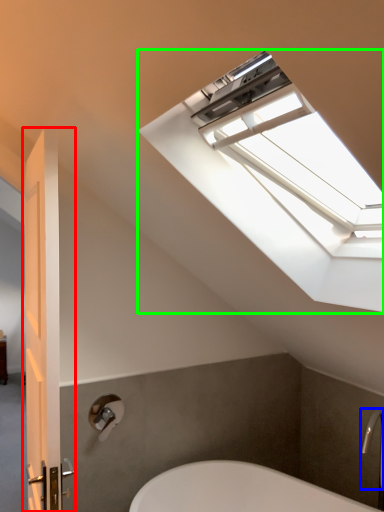
Question: Which object is the farthest from door (highlighted by a red box)? Choose among these: faucet (highlighted by a blue box) or window (highlighted by a green box).

Choices:
 (A) faucet
 (B) window

Answer: (A)